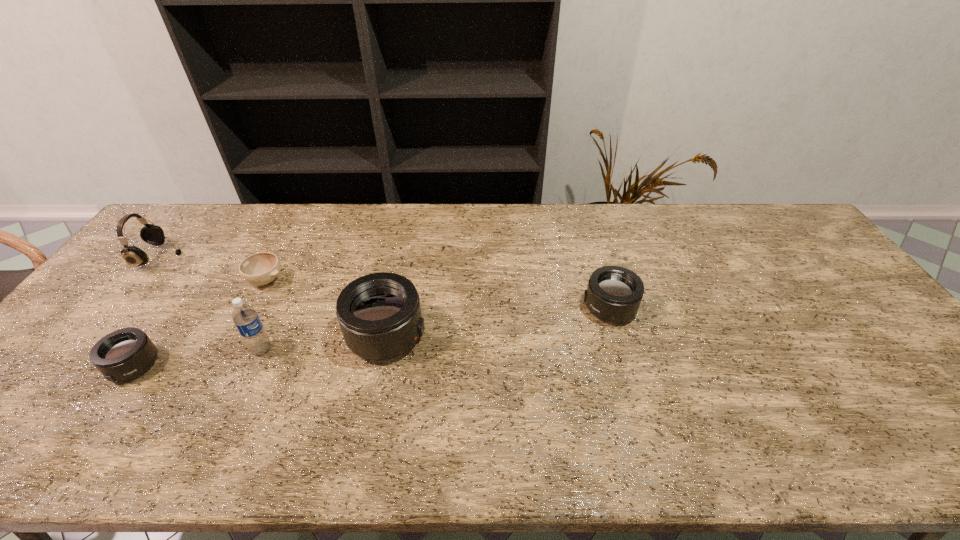
Identify the location of the fifth object from right to left. (124, 354).

Where is `the shortest telephoto lens`? the shortest telephoto lens is located at coordinates (124, 354).

The height and width of the screenshot is (540, 960). I want to click on the tallest telephoto lens, so click(x=379, y=314).

Where is `the fifth object from left to right`? The width and height of the screenshot is (960, 540). the fifth object from left to right is located at coordinates (379, 314).

Locate an element on the screen. The height and width of the screenshot is (540, 960). the rightmost telephoto lens is located at coordinates point(614,293).

Locate an element on the screen. the second shortest telephoto lens is located at coordinates (614, 293).

Locate an element on the screen. This screenshot has height=540, width=960. bowl is located at coordinates (261, 268).

Where is `headset`? This screenshot has width=960, height=540. headset is located at coordinates (151, 234).

In order to click on water bottle in this screenshot , I will do `click(245, 318)`.

The width and height of the screenshot is (960, 540). I want to click on vacant region located 0.380m on the side of the second telephoto lens from left to right with brand markings and control switches, so click(569, 335).